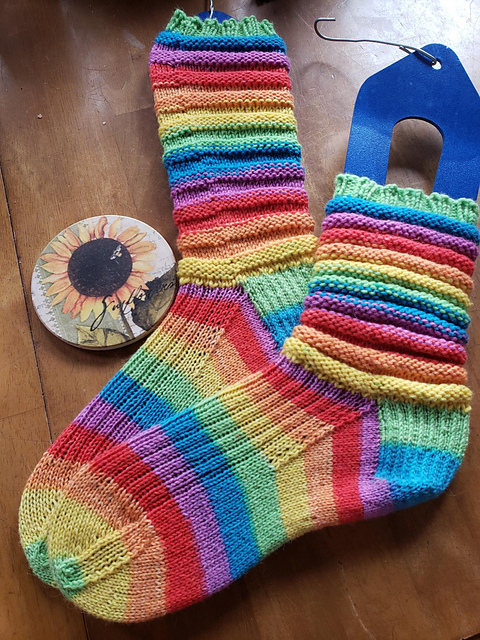
What are the coordinates of `sock` in the screenshot? It's located at (244, 312).